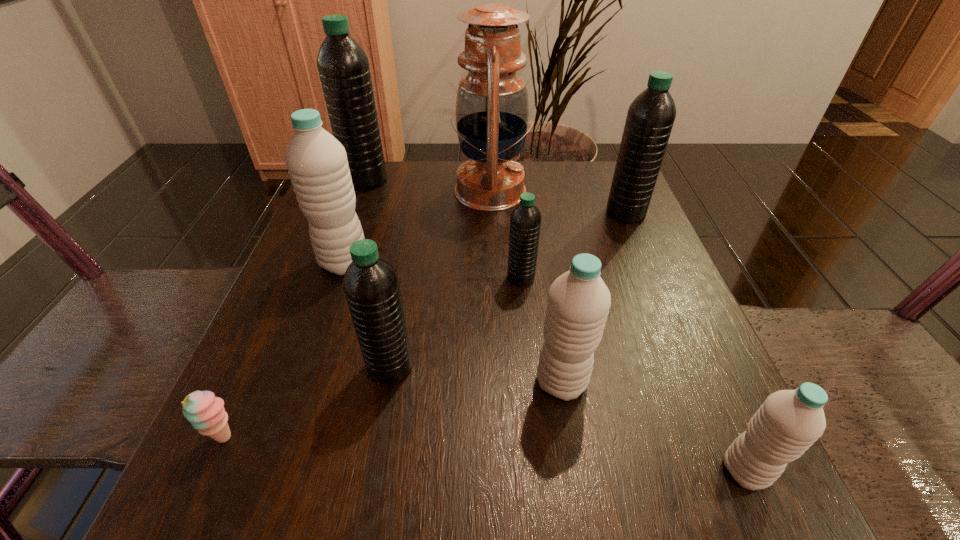
This screenshot has width=960, height=540. Find the location of `object that is at the near right corner`. object that is at the near right corner is located at coordinates (789, 421).

In the image, there is a desktop. At what (x,y) coordinates should I click in order to perform the action: click on vacant space at the far edge. Please return your answer as a coordinate pair (x, y). The width and height of the screenshot is (960, 540). Looking at the image, I should click on (442, 176).

You are a GUI agent. You are given a task and a screenshot of the screen. Output one action in this format:
    pyautogui.click(x=<x>, y=<y>)
    Task: Click on the vacant area at the left edge of the desktop
    
    Given the screenshot: What is the action you would take?
    pyautogui.click(x=379, y=251)

Identify the location of vacant area at the right edge of the desktop. This screenshot has width=960, height=540. (678, 400).

Image resolution: width=960 pixels, height=540 pixels. What are the coordinates of `vacant space at the near left corner` in the screenshot? It's located at (248, 525).

In the image, there is a desktop. Where is `free space at the far right corner`? Image resolution: width=960 pixels, height=540 pixels. free space at the far right corner is located at coordinates (612, 165).

In order to click on vacant space at the near right corner in this screenshot , I will do `click(684, 484)`.

I want to click on free area in between the second nearest white water bottle and the smallest black water bottle, so click(x=541, y=329).

Where is `unoccupied area between the third farthest black water bottle and the blue oil lamp`? unoccupied area between the third farthest black water bottle and the blue oil lamp is located at coordinates (506, 234).

Locate an element on the screen. unoccupied position between the nearest black water bottle and the second black water bottle from right to left is located at coordinates (455, 322).